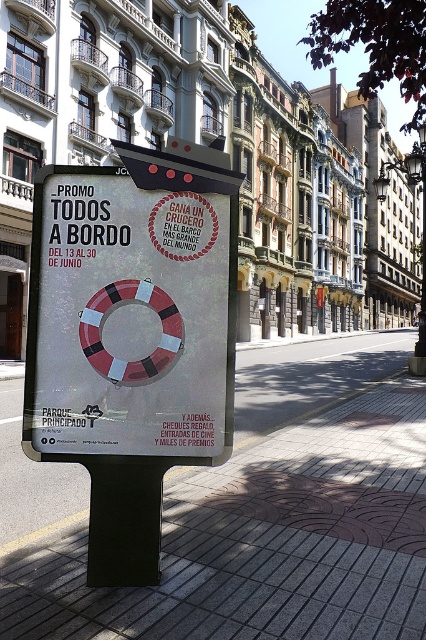
You are a delivery person standing at the edge of the sidewalk. You need to place a package on the brick pavement at center and then move to the white paper lifebuoy at center to pick up a signature. How far will you have to walk between these two locations?

The brick pavement at center is 7.65 feet away from the white paper lifebuoy at center, so you will have to walk 7.65 feet between these two locations.

You are a delivery person who needs to place a small package on the surface that can hold it. Based on the scene, which object between the brick pavement at center and the white paper lifebuoy at center would be more suitable for placing the package?

The brick pavement at center has a larger size compared to the white paper lifebuoy at center, so the brick pavement at center would be more suitable for placing the small package.

You are designing a new promotional sign and want to ensure the white paper lifebuoy at center is visible. Given the brick pavement at center is wider, how should you adjust the lifebuoy size?

Since the brick pavement at center is wider than the white paper lifebuoy at center, you should increase the size of the white paper lifebuoy at center to ensure it is proportionate and visible against the wider pavement.